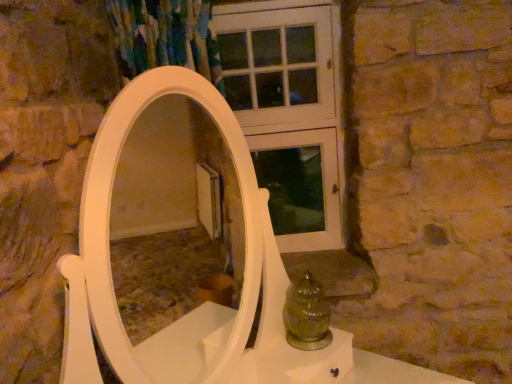
The image size is (512, 384). I want to click on amber glass jar at lower center, so click(x=307, y=315).

What do you see at coordinates (307, 315) in the screenshot? I see `amber glass jar at lower center` at bounding box center [307, 315].

What do you see at coordinates (290, 97) in the screenshot?
I see `white wooden screen door at upper center` at bounding box center [290, 97].

Locate an element on the screen. The image size is (512, 384). white wooden screen door at upper center is located at coordinates click(x=290, y=97).

In order to face white wooden screen door at upper center, should I rotate leftwards or rightwards?

Rotate your view left by about 1.612°.

What is the approximate width of white wooden screen door at upper center?

It is 4.26 inches.

You are a GUI agent. You are given a task and a screenshot of the screen. Output one action in this format:
    pyautogui.click(x=<x>, y=<y>)
    Task: Click on the amber glass jar at lower center
    
    Given the screenshot: What is the action you would take?
    pyautogui.click(x=307, y=315)

Visually, is white wooden screen door at upper center positioned to the left or to the right of amber glass jar at lower center?

white wooden screen door at upper center is positioned on amber glass jar at lower center's left side.

Which is behind, white wooden screen door at upper center or amber glass jar at lower center?

Positioned behind is white wooden screen door at upper center.

Between point (321, 97) and point (318, 341), which one is positioned behind?

Point (321, 97)

From the image's perspective, is white wooden screen door at upper center located above or below amber glass jar at lower center?

white wooden screen door at upper center is above amber glass jar at lower center.

From a real-world perspective, relative to amber glass jar at lower center, is white wooden screen door at upper center vertically above or below?

white wooden screen door at upper center is above amber glass jar at lower center.

Considering the sizes of objects white wooden screen door at upper center and amber glass jar at lower center in the image provided, who is thinner, white wooden screen door at upper center or amber glass jar at lower center?

With smaller width is white wooden screen door at upper center.

Between white wooden screen door at upper center and amber glass jar at lower center, which one has less height?

amber glass jar at lower center.

Who is bigger, white wooden screen door at upper center or amber glass jar at lower center?

With larger size is white wooden screen door at upper center.

Is white wooden screen door at upper center inside or outside of amber glass jar at lower center?

white wooden screen door at upper center is outside amber glass jar at lower center.

Is white wooden screen door at upper center not near amber glass jar at lower center?

No, white wooden screen door at upper center is not far from amber glass jar at lower center.

Could you tell me if white wooden screen door at upper center is turned towards amber glass jar at lower center?

Yes, white wooden screen door at upper center is oriented towards amber glass jar at lower center.

How many degrees apart are the facing directions of white wooden screen door at upper center and amber glass jar at lower center?

The angular difference between white wooden screen door at upper center and amber glass jar at lower center is 49.7 degrees.

Image resolution: width=512 pixels, height=384 pixels. In the image, there is a amber glass jar at lower center. Find the location of `screen door above it (from the image's perspective)`. screen door above it (from the image's perspective) is located at coordinates (290, 97).

Which object is positioned more to the left, amber glass jar at lower center or white wooden screen door at upper center?

white wooden screen door at upper center.

Does amber glass jar at lower center come behind white wooden screen door at upper center?

No, the depth of amber glass jar at lower center is less than that of white wooden screen door at upper center.

Which point is more distant from viewer, [300,334] or [262,138]?

The point [262,138] is behind.

Consider the image. From the image's perspective, is amber glass jar at lower center above or below white wooden screen door at upper center?

Clearly, from the image's perspective, amber glass jar at lower center is below white wooden screen door at upper center.

From a real-world perspective, which is physically above, amber glass jar at lower center or white wooden screen door at upper center?

In real-world perspective, white wooden screen door at upper center is above.

Which object is wider, amber glass jar at lower center or white wooden screen door at upper center?

With larger width is amber glass jar at lower center.

Which of these two, amber glass jar at lower center or white wooden screen door at upper center, stands shorter?

Standing shorter between the two is amber glass jar at lower center.

Considering the relative sizes of amber glass jar at lower center and white wooden screen door at upper center in the image provided, is amber glass jar at lower center bigger than white wooden screen door at upper center?

Actually, amber glass jar at lower center might be smaller than white wooden screen door at upper center.

Is white wooden screen door at upper center inside amber glass jar at lower center?

No, white wooden screen door at upper center is not inside amber glass jar at lower center.

Is amber glass jar at lower center far away from white wooden screen door at upper center?

amber glass jar at lower center is near white wooden screen door at upper center, not far away.

Is amber glass jar at lower center looking in the opposite direction of white wooden screen door at upper center?

That's not correct — amber glass jar at lower center is not looking away from white wooden screen door at upper center.

You are a GUI agent. You are given a task and a screenshot of the screen. Output one action in this format:
    pyautogui.click(x=<x>, y=<y>)
    Task: Click on the glass vase in front of the white wooden screen door at upper center
    This screenshot has width=512, height=384.
    Given the screenshot: What is the action you would take?
    pyautogui.click(x=307, y=315)

Where is `glass vase lying on the right of white wooden screen door at upper center`? glass vase lying on the right of white wooden screen door at upper center is located at coordinates (307, 315).

Locate an element on the screen. glass vase in front of the white wooden screen door at upper center is located at coordinates (307, 315).